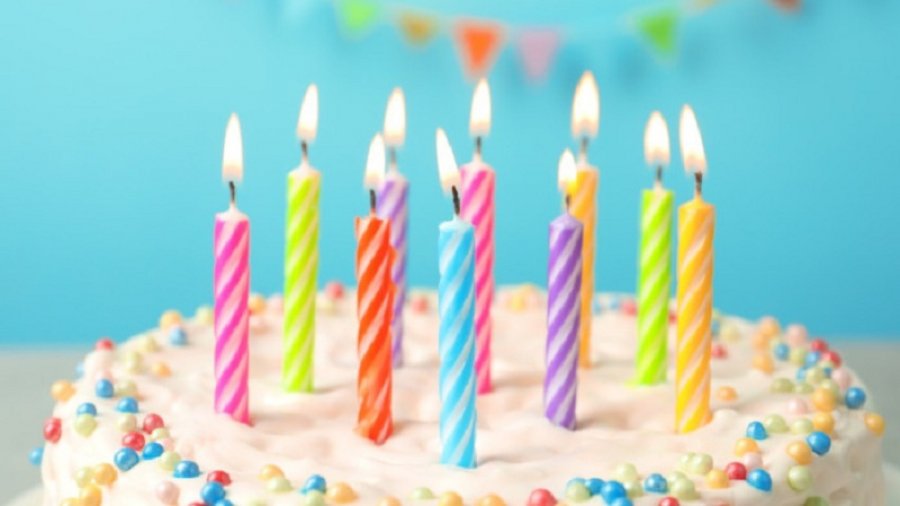
You are a GUI agent. You are given a task and a screenshot of the screen. Output one action in this format:
    pyautogui.click(x=<x>, y=<y>)
    Task: Click on the candle flames
    
    Given the screenshot: What is the action you would take?
    pyautogui.click(x=655, y=143), pyautogui.click(x=693, y=152), pyautogui.click(x=588, y=98), pyautogui.click(x=568, y=166), pyautogui.click(x=478, y=112), pyautogui.click(x=444, y=147), pyautogui.click(x=399, y=119), pyautogui.click(x=378, y=165), pyautogui.click(x=304, y=118), pyautogui.click(x=232, y=148)